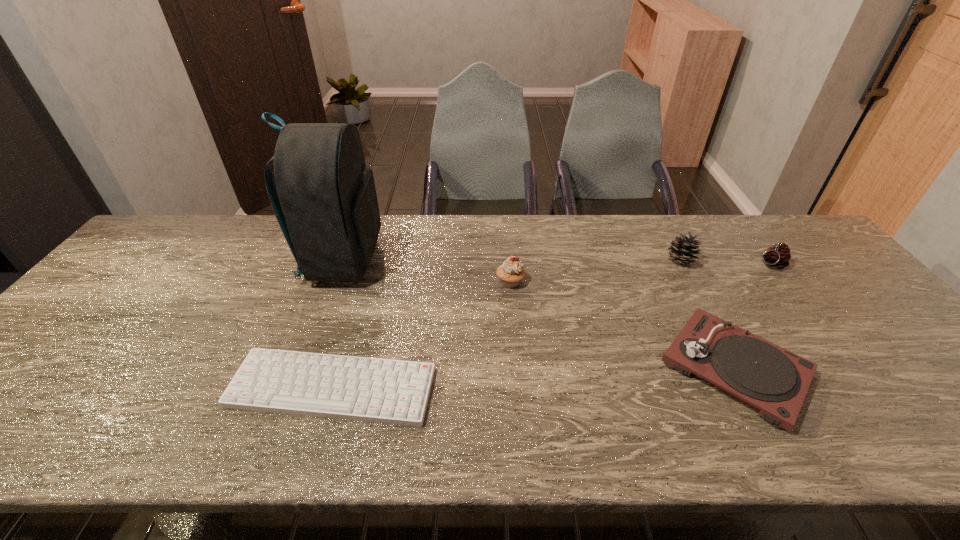
Image resolution: width=960 pixels, height=540 pixels. I want to click on vacant space at the far edge, so click(x=725, y=244).

The image size is (960, 540). I want to click on free space at the near edge of the desktop, so click(152, 446).

Find the location of a particular element. This screenshot has height=540, width=960. blank space at the right edge of the desktop is located at coordinates (885, 330).

Locate an element on the screen. The height and width of the screenshot is (540, 960). vacant area that lies between the second shortest object and the rightmost object is located at coordinates (753, 316).

The width and height of the screenshot is (960, 540). Find the location of `vacant space that is in between the computer keyboard and the cupcake`. vacant space that is in between the computer keyboard and the cupcake is located at coordinates (421, 335).

At what (x,y) coordinates should I click in order to perform the action: click on vacant space that's between the second shortest object and the right pinecone. Please return your answer as a coordinate pair (x, y). Looking at the image, I should click on (753, 316).

Identify the location of vacant region between the computer keyboard and the taller pinecone. (506, 324).

At what (x,y) coordinates should I click in order to perform the action: click on vacant space in between the fourth tallest object and the backpack. Please return your answer as a coordinate pair (x, y). Looking at the image, I should click on (557, 262).

Image resolution: width=960 pixels, height=540 pixels. Find the location of `blank region between the rightmost object and the shortest object`. blank region between the rightmost object and the shortest object is located at coordinates (551, 326).

The image size is (960, 540). I want to click on free space between the second shortest object and the third object from left to right, so click(623, 325).